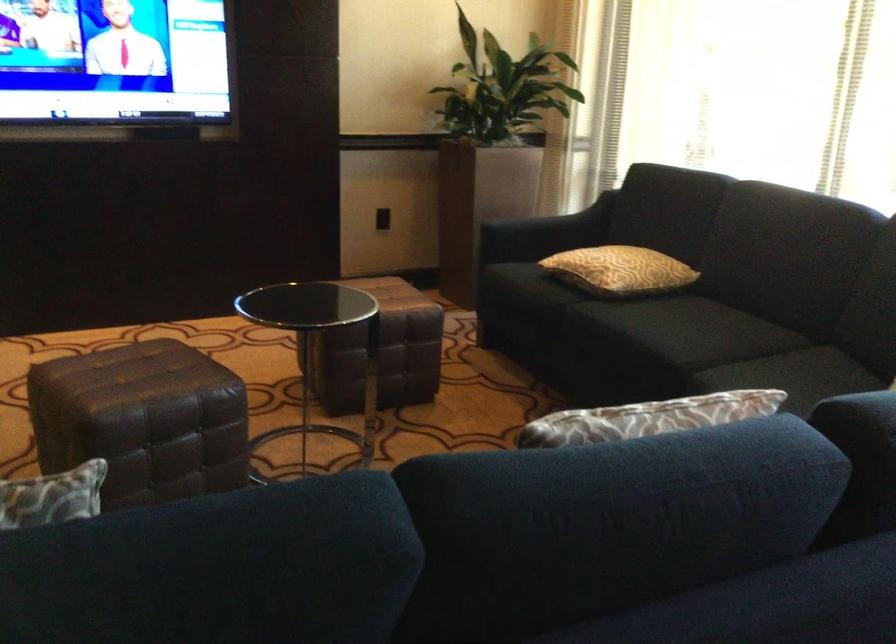
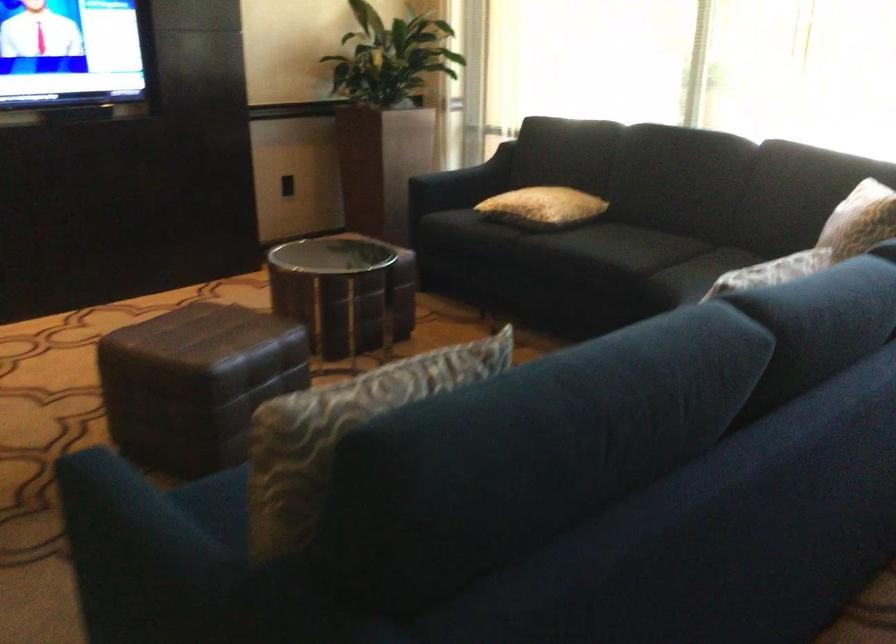
The point at (x=539, y=232) is marked in the first image. Where is the corresponding point in the second image?

(460, 184)